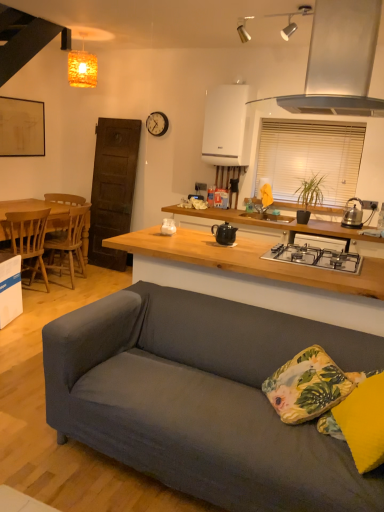
In order to click on vacant area located to the right-hand side of white glossy coffee cup at center in this screenshot , I will do coord(196,234).